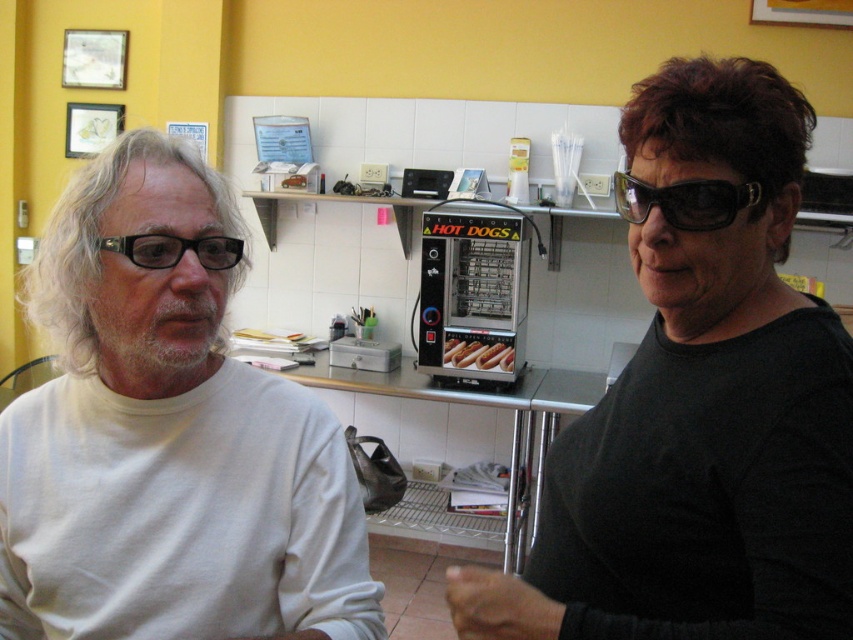
Which is more to the left, sunglasses at right or black plastic glasses at left?

black plastic glasses at left is more to the left.

Can you confirm if sunglasses at right is positioned to the right of black plastic glasses at left?

Yes, sunglasses at right is to the right of black plastic glasses at left.

This screenshot has width=853, height=640. What do you see at coordinates (683, 202) in the screenshot?
I see `sunglasses at right` at bounding box center [683, 202].

Locate an element on the screen. The height and width of the screenshot is (640, 853). sunglasses at right is located at coordinates (683, 202).

Between white matte shirt at left and black plastic glasses at left, which one is positioned lower?

white matte shirt at left is lower down.

Can you confirm if white matte shirt at left is shorter than black plastic glasses at left?

No.

Is point (108, 365) less distant than point (207, 237)?

No, it is not.

This screenshot has height=640, width=853. What are the coordinates of `white matte shirt at left` in the screenshot? It's located at (167, 440).

Which is below, white matte shirt at left or sunglasses at right?

white matte shirt at left is below.

Is white matte shirt at left above sunglasses at right?

No.

Measure the distance between point (154, 346) and camera.

Point (154, 346) and camera are 35.43 inches apart.

This screenshot has height=640, width=853. Identify the location of white matte shirt at left. (167, 440).